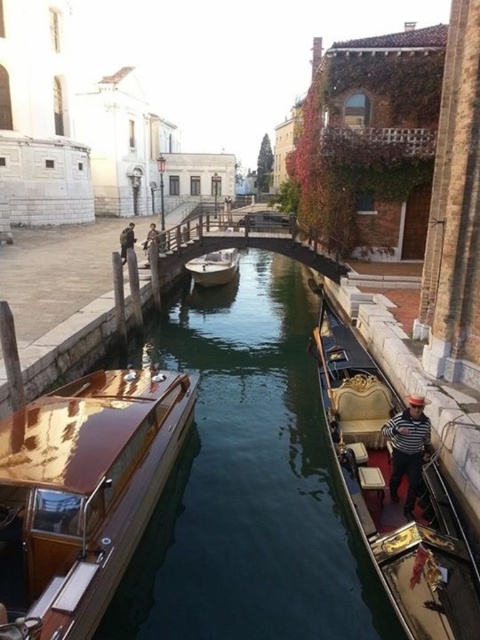
You are a tourist standing on the pedestrian bridge in the canal scene. You see a gold polished wood gondola at center and a wooden polished boat at center. Which one is closer to the right side of the canal?

The gold polished wood gondola at center is closer to the right side of the canal since it is positioned to the right of the wooden polished boat at center.

You are a tourist standing on the pedestrian bridge in the canal scene. You see two boats below you on the water. Which boat is positioned to the left side of the other? The boats are the glossy wood boat at center and the wooden polished boat at center.

The glossy wood boat at center is positioned to the left of the wooden polished boat at center.